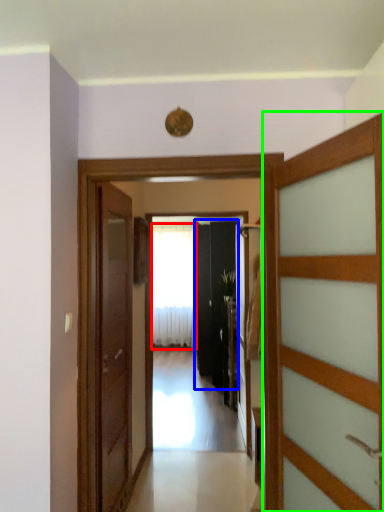
Question: Which object is the farthest from curtain (highlighted by a red box)? Choose among these: door (highlighted by a blue box) or door (highlighted by a green box).

Choices:
 (A) door
 (B) door

Answer: (B)